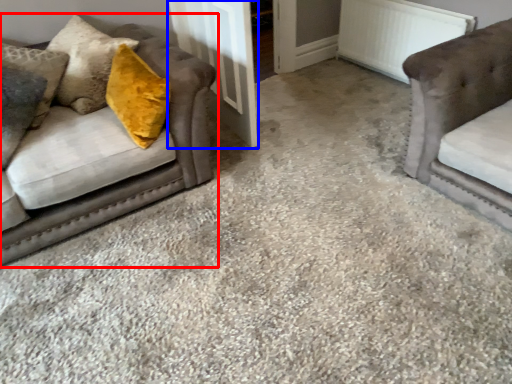
Question: Which object appears closest to the camera in this image, studio couch (highlighted by a red box) or door (highlighted by a blue box)?

Choices:
 (A) studio couch
 (B) door

Answer: (A)